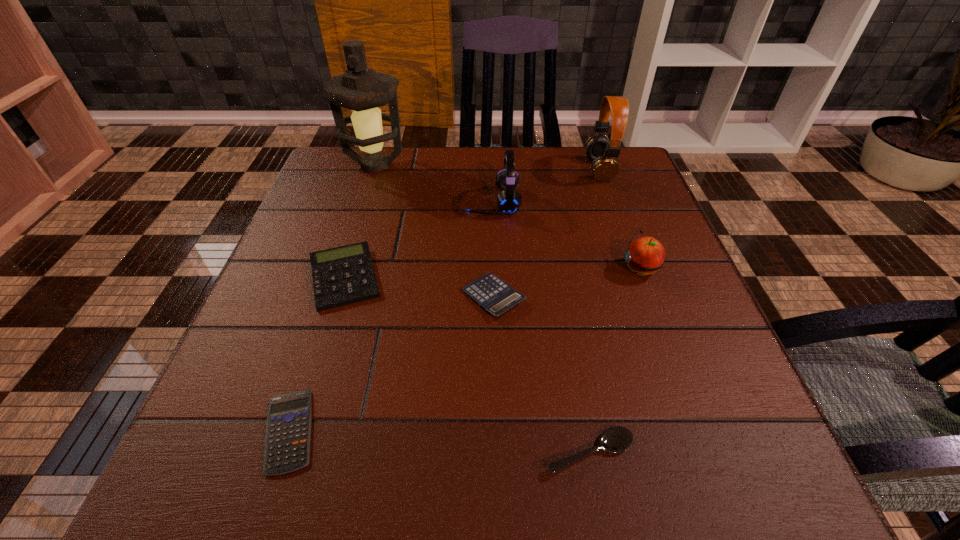
Where is `oil lamp`? This screenshot has height=540, width=960. oil lamp is located at coordinates (361, 89).

The width and height of the screenshot is (960, 540). In order to click on the farther headset in this screenshot , I will do `click(603, 153)`.

You are a GUI agent. You are given a task and a screenshot of the screen. Output one action in this format:
    pyautogui.click(x=<x>, y=<y>)
    Task: Click on the seventh shortest object
    This screenshot has height=540, width=960.
    Given the screenshot: What is the action you would take?
    pyautogui.click(x=603, y=153)

At what (x,y) coordinates should I click in order to perform the action: click on the shorter headset. Please return your answer as a coordinate pair (x, y). The width and height of the screenshot is (960, 540). Looking at the image, I should click on (507, 179).

Identify the location of the sixth nearest object. The width and height of the screenshot is (960, 540). (507, 179).

Image resolution: width=960 pixels, height=540 pixels. Find the location of `apple`. apple is located at coordinates (645, 255).

Image resolution: width=960 pixels, height=540 pixels. Find the location of `the second tallest calculator`. the second tallest calculator is located at coordinates (495, 296).

Find the location of a particular element. The width and height of the screenshot is (960, 540). soupspoon is located at coordinates (615, 439).

The height and width of the screenshot is (540, 960). In order to click on the nearest calculator in this screenshot , I will do `click(288, 429)`.

Locate an element on the screen. The image size is (960, 540). the shortest object is located at coordinates (288, 429).